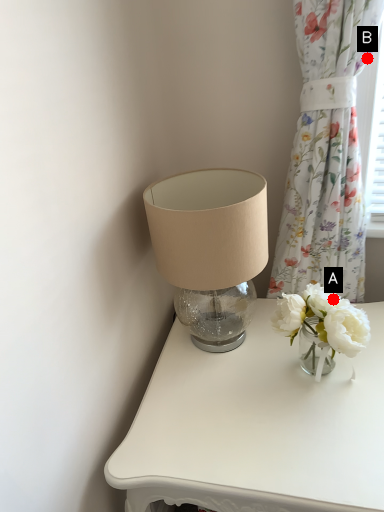
Question: Two points are circled on the image, labeled by A and B beside each circle. Which point is closer to the camera taking this photo?

Choices:
 (A) A is closer
 (B) B is closer

Answer: (A)